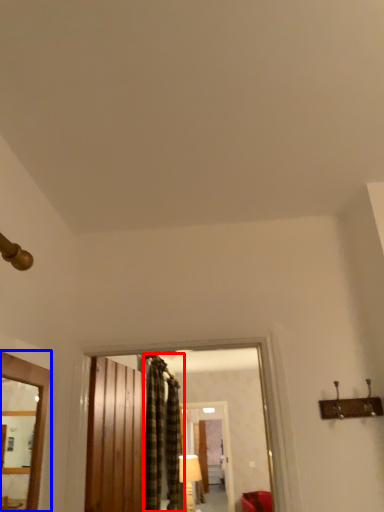
Question: Which point is closer to the camera, curtain (highlighted by a red box) or window (highlighted by a blue box)?

Choices:
 (A) curtain
 (B) window

Answer: (B)